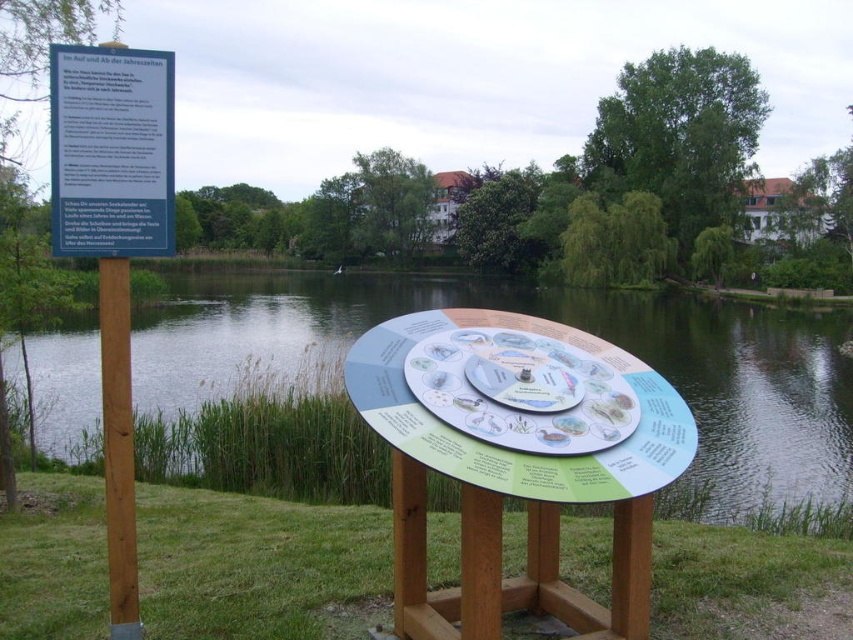
You are standing at the educational display near the water. There are two points marked on the circular board. One is at coordinates point (293, 276) and the other at point (103, 300). Which point is closer to you?

Point (103, 300) is closer to you because point (293, 276) is behind it.